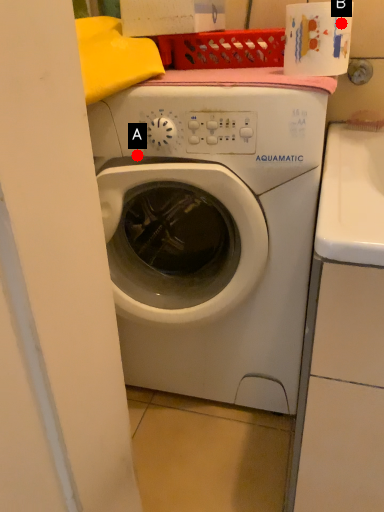
Question: Two points are circled on the image, labeled by A and B beside each circle. Which point is closer to the camera taking this photo?

Choices:
 (A) A is closer
 (B) B is closer

Answer: (B)